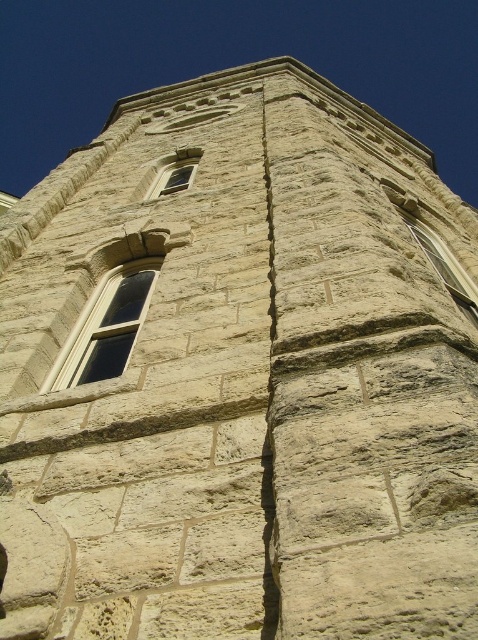
Question: Can you confirm if clear glass window at center is thinner than clear stone window at upper right?

Choices:
 (A) no
 (B) yes

Answer: (A)

Question: Which is farther from the clear stone window at upper right?

Choices:
 (A) matte stone window at upper center
 (B) clear glass window at center

Answer: (A)

Question: Which point is farther to the camera?

Choices:
 (A) (185, 164)
 (B) (402, 212)
 (C) (128, 282)

Answer: (A)

Question: Does clear glass window at center lie in front of matte stone window at upper center?

Choices:
 (A) yes
 (B) no

Answer: (A)

Question: Does clear stone window at upper right lie behind matte stone window at upper center?

Choices:
 (A) yes
 (B) no

Answer: (B)

Question: Which of the following is the farthest from the observer?

Choices:
 (A) (475, 321)
 (B) (76, 353)

Answer: (A)